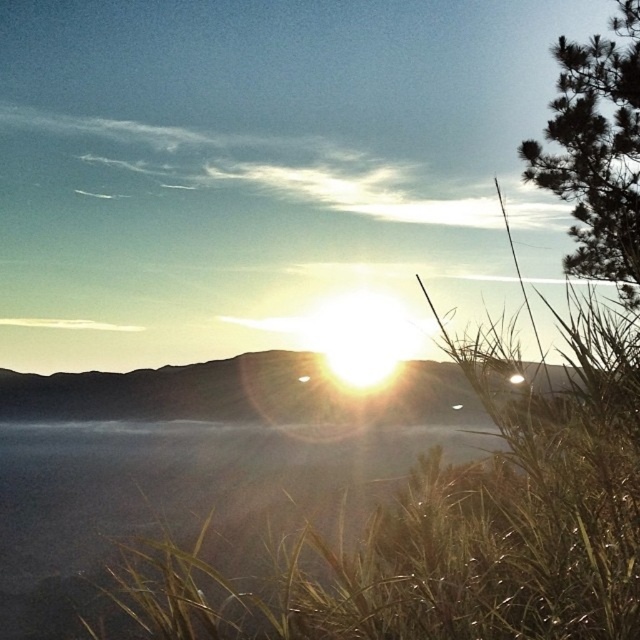
Locate an element on the screen. The height and width of the screenshot is (640, 640). sandy brown hillside at center is located at coordinates (180, 392).

Can you confirm if sandy brown hillside at center is shorter than green leafy tree at upper right?

Correct, sandy brown hillside at center is not as tall as green leafy tree at upper right.

Between point (317, 371) and point (609, 163), which one is positioned behind?

The point (317, 371) is behind.

The image size is (640, 640). I want to click on sandy brown hillside at center, so click(x=180, y=392).